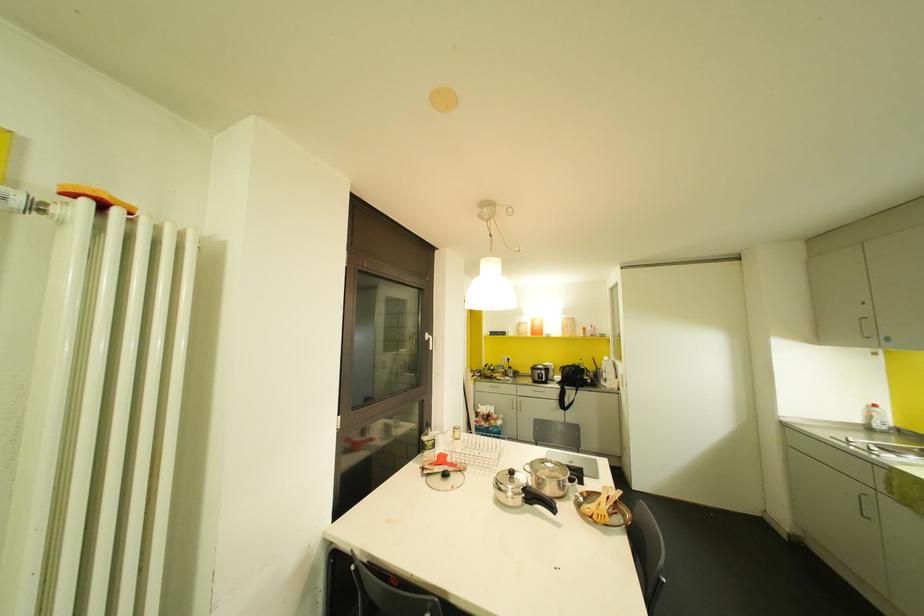
You are a GUI agent. You are given a task and a screenshot of the screen. Output one action in this format:
    pyautogui.click(x=<x>, y=<y>)
    Task: Click on the glass bottle
    
    Given the screenshot: What is the action you would take?
    pyautogui.click(x=428, y=445)